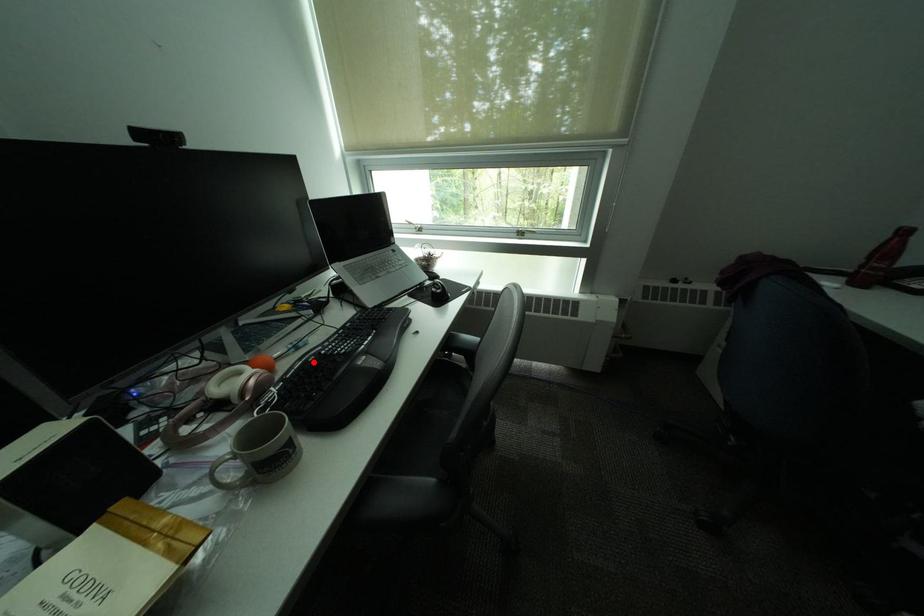
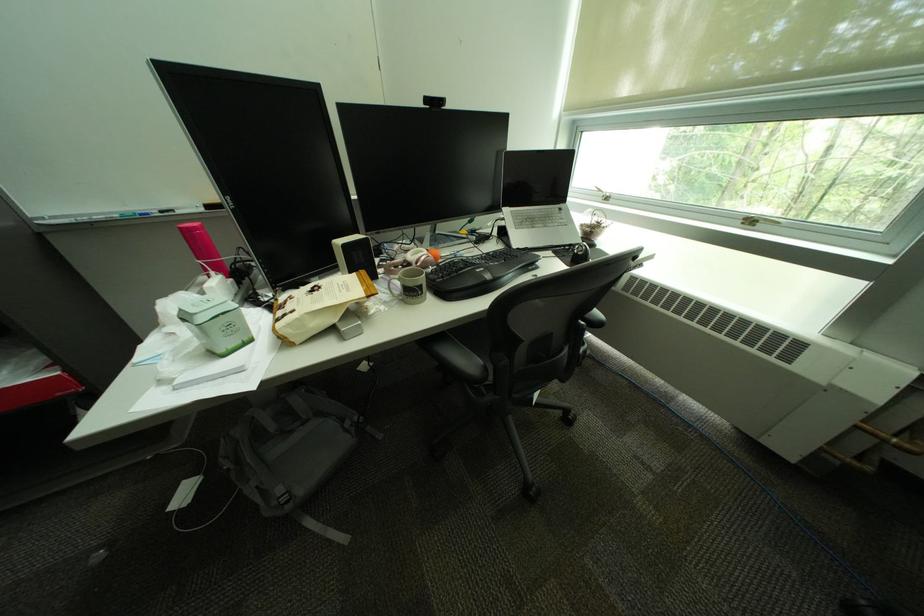
Locate, in the second image, the point that corresponds to the highlighted location in the first image.

(463, 261)